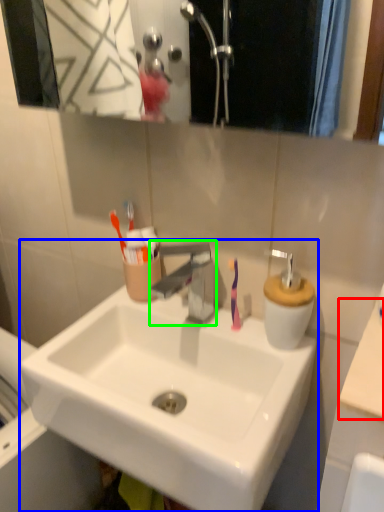
Question: Based on their relative distances, which object is farther from counter top (highlighted by a red box)? Choose from sink (highlighted by a blue box) and tap (highlighted by a green box).

Choices:
 (A) sink
 (B) tap

Answer: (B)